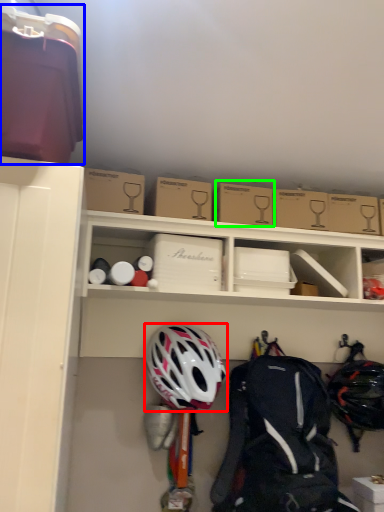
Question: Which is nearer to the helmet (highlighted by a red box)? box (highlighted by a blue box) or cardboard box (highlighted by a green box).

Choices:
 (A) box
 (B) cardboard box

Answer: (B)